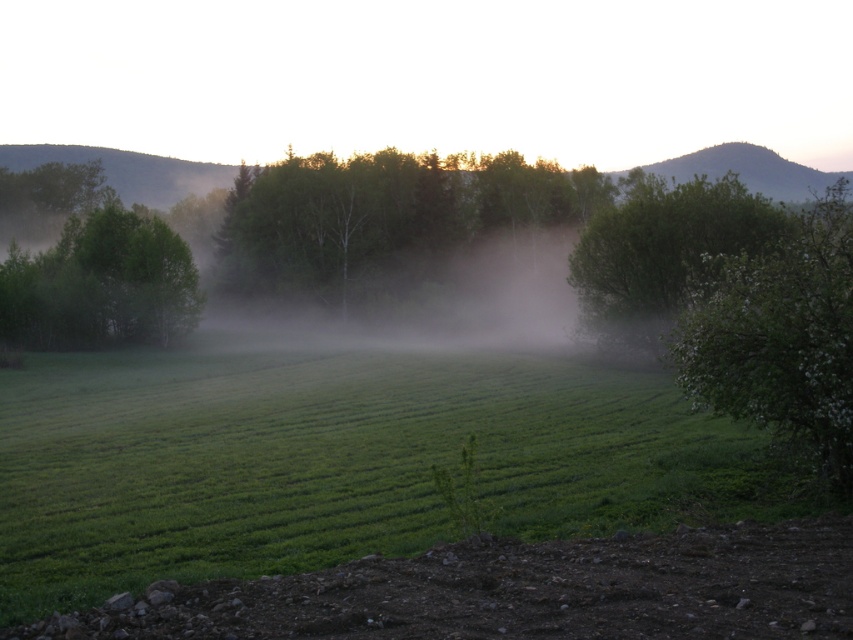
Question: Which point is closer to the camera?

Choices:
 (A) green matte tree at left
 (B) foggy mist at center
 (C) green grassy field at center

Answer: (C)

Question: Is green leafy tree at upper right to the left of green matte tree at left from the viewer's perspective?

Choices:
 (A) yes
 (B) no

Answer: (B)

Question: Can you confirm if green grassy field at center is positioned to the right of green leafy tree at upper right?

Choices:
 (A) yes
 (B) no

Answer: (B)

Question: Which object is positioned farthest from the green matte tree at center?

Choices:
 (A) green grassy field at center
 (B) green matte tree at left
 (C) green leafy tree at right

Answer: (C)

Question: Does green matte tree at center come in front of foggy mist at center?

Choices:
 (A) yes
 (B) no

Answer: (B)

Question: Which of these objects is positioned closest to the green leafy tree at upper right?

Choices:
 (A) green leafy tree at right
 (B) foggy mist at center
 (C) green matte tree at center
 (D) green grassy field at center

Answer: (B)